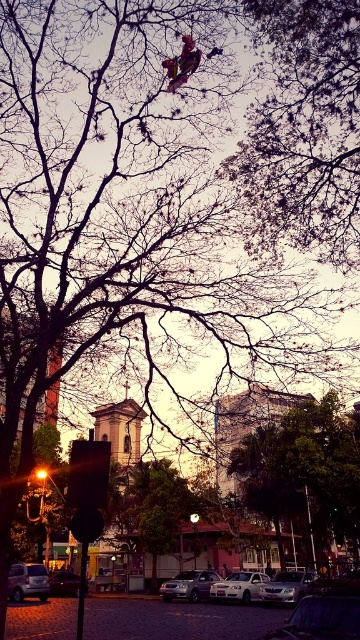
You are a photographer standing on the cobblestone street and want to capture a photo that includes both the brown textured tree at upper center and the matte silver car at lower left. Which object should you focus on first to ensure both are in frame?

The brown textured tree at upper center is much taller than the matte silver car at lower left, so you should focus on the brown textured tree at upper center first to ensure both are in frame.

You are standing at the point with coordinates point (217, 593) and want to walk to the point with coordinates point (60, 582). According to the scene, will you be moving towards the foreground or the background?

Since point (217, 593) is in front of point (60, 582), moving from point (217, 593) to point (60, 582) means you are moving towards the background.